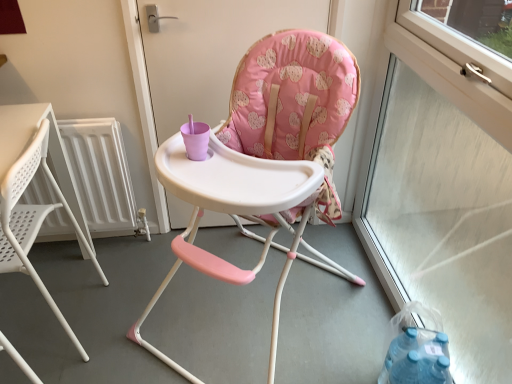
The height and width of the screenshot is (384, 512). Describe the element at coordinates (102, 175) in the screenshot. I see `white metallic radiator at left` at that location.

In order to click on matte plastic highchair at center, which is the 1th chair in right-to-left order in this screenshot , I will do `click(271, 154)`.

Considering the sizes of objects transparent glass window at right and matte plastic highchair at center, which is the 1th chair in right-to-left order, in the image provided, who is smaller, transparent glass window at right or matte plastic highchair at center, which is the 1th chair in right-to-left order,?

transparent glass window at right is smaller.

The image size is (512, 384). Identify the location of the 1st chair behind the transparent glass window at right. (271, 154).

Could you measure the distance between transparent glass window at right and matte plastic highchair at center, the 2th chair from the left?

transparent glass window at right and matte plastic highchair at center, the 2th chair from the left, are 20.85 inches apart.

Is matte plastic highchair at center, which is the 1th chair in right-to-left order, at the back of transparent glass window at right?

Yes, transparent glass window at right's orientation is away from matte plastic highchair at center, which is the 1th chair in right-to-left order.

What's the angular difference between pink fabric high chair at center and transparent glass window at right's facing directions?

89.4 degrees separate the facing orientations of pink fabric high chair at center and transparent glass window at right.

From a real-world perspective, is pink fabric high chair at center physically above transparent glass window at right?

No, from a real-world perspective, pink fabric high chair at center is not above transparent glass window at right.

Considering the relative positions of pink fabric high chair at center and transparent glass window at right in the image provided, is pink fabric high chair at center behind transparent glass window at right?

Yes, pink fabric high chair at center is further from the camera.

Considering the sizes of objects pink fabric high chair at center and transparent glass window at right in the image provided, who is wider, pink fabric high chair at center or transparent glass window at right?

With larger width is transparent glass window at right.

Considering the sizes of objects transparent glass window at right and white metallic radiator at left in the image provided, who is taller, transparent glass window at right or white metallic radiator at left?

Standing taller between the two is transparent glass window at right.

Considering the sizes of objects transparent glass window at right and white metallic radiator at left in the image provided, who is thinner, transparent glass window at right or white metallic radiator at left?

With smaller width is white metallic radiator at left.

Which object is more forward, transparent glass window at right or white metallic radiator at left?

transparent glass window at right.

Which object is positioned more to the left, transparent glass window at right or white metallic radiator at left?

white metallic radiator at left.

From a real-world perspective, is white metallic radiator at left on matte plastic highchair at center, the 2th chair from the left?

No.

Can you confirm if white metallic radiator at left is smaller than matte plastic highchair at center, the 2th chair from the left?

Indeed, white metallic radiator at left has a smaller size compared to matte plastic highchair at center, the 2th chair from the left.

Can you confirm if white metallic radiator at left is thinner than matte plastic highchair at center, which is the 1th chair in right-to-left order?

Correct, the width of white metallic radiator at left is less than that of matte plastic highchair at center, which is the 1th chair in right-to-left order.

How far apart are white metallic radiator at left and matte plastic highchair at center, the 2th chair from the left?

white metallic radiator at left and matte plastic highchair at center, the 2th chair from the left, are 26.57 inches apart from each other.

From a real-world perspective, which is physically above, white plastic chair at left, the first chair viewed from the left, or transparent glass window at right?

transparent glass window at right is physically above.

Measure the distance from white plastic chair at left, acting as the 2th chair starting from the right, to transparent glass window at right.

white plastic chair at left, acting as the 2th chair starting from the right, and transparent glass window at right are 4.72 feet apart from each other.

From their relative heights in the image, would you say white plastic chair at left, the first chair viewed from the left, is taller or shorter than transparent glass window at right?

Considering their sizes, white plastic chair at left, the first chair viewed from the left, has less height than transparent glass window at right.

Is white plastic chair at left, the first chair viewed from the left, inside or outside of transparent glass window at right?

white plastic chair at left, the first chair viewed from the left, is not enclosed by transparent glass window at right.

Who is smaller, white metallic radiator at left or pink fabric high chair at center?

white metallic radiator at left is smaller.

Between white metallic radiator at left and pink fabric high chair at center, which one has more height?

With more height is pink fabric high chair at center.

Which object is further away from the camera, white metallic radiator at left or pink fabric high chair at center?

Positioned behind is white metallic radiator at left.

From the image's perspective, would you say white plastic chair at left, the first chair viewed from the left, is shown under matte plastic highchair at center, the 2th chair from the left?

Indeed, from the image's perspective, white plastic chair at left, the first chair viewed from the left, is shown beneath matte plastic highchair at center, the 2th chair from the left.

Which is in front, white plastic chair at left, the first chair viewed from the left, or matte plastic highchair at center, which is the 1th chair in right-to-left order?

Positioned in front is matte plastic highchair at center, which is the 1th chair in right-to-left order.

Is point (80, 239) positioned in front of point (331, 66)?

That is False.

Does white plastic chair at left, acting as the 2th chair starting from the right, turn towards matte plastic highchair at center, the 2th chair from the left?

No, white plastic chair at left, acting as the 2th chair starting from the right, is not oriented towards matte plastic highchair at center, the 2th chair from the left.

I want to click on the 1st chair positioned below the transparent glass window at right (from a real-world perspective), so click(x=271, y=154).

This screenshot has width=512, height=384. What are the coordinates of `window screen below the pink fabric high chair at center (from the image's perspective)` in the screenshot? It's located at (447, 176).

Looking at the image, which one is located further to pink fabric high chair at center, transparent glass window at right or white plastic chair at left, acting as the 2th chair starting from the right?

transparent glass window at right lies further to pink fabric high chair at center than the other object.

From the image, which object appears to be nearer to matte plastic highchair at center, which is the 1th chair in right-to-left order, transparent glass window at right or pink fabric high chair at center?

pink fabric high chair at center lies closer to matte plastic highchair at center, which is the 1th chair in right-to-left order, than the other object.

Based on their spatial positions, is white metallic radiator at left or matte plastic highchair at center, the 2th chair from the left, further from transparent glass window at right?

The object further to transparent glass window at right is white metallic radiator at left.

Estimate the real-world distances between objects in this image. Which object is further from pink fabric high chair at center, matte plastic highchair at center, the 2th chair from the left, or transparent glass window at right?

transparent glass window at right.

Which object lies further to the anchor point white metallic radiator at left, white plastic chair at left, acting as the 2th chair starting from the right, or matte plastic highchair at center, which is the 1th chair in right-to-left order?

Among the two, matte plastic highchair at center, which is the 1th chair in right-to-left order, is located further to white metallic radiator at left.

Looking at the image, which one is located further to white metallic radiator at left, matte plastic highchair at center, which is the 1th chair in right-to-left order, or pink fabric high chair at center?

Among the two, matte plastic highchair at center, which is the 1th chair in right-to-left order, is located further to white metallic radiator at left.

Considering their positions, is matte plastic highchair at center, the 2th chair from the left, positioned closer to pink fabric high chair at center than white metallic radiator at left?

matte plastic highchair at center, the 2th chair from the left, lies closer to pink fabric high chair at center than the other object.

Considering their positions, is pink fabric high chair at center positioned closer to white plastic chair at left, the first chair viewed from the left, than transparent glass window at right?

pink fabric high chair at center is positioned closer to the anchor white plastic chair at left, the first chair viewed from the left.

Locate an element on the screen. This screenshot has width=512, height=384. radiator situated between white plastic chair at left, acting as the 2th chair starting from the right, and pink fabric high chair at center from left to right is located at coordinates (102, 175).

This screenshot has height=384, width=512. Identify the location of screen door positioned between matte plastic highchair at center, the 2th chair from the left, and white metallic radiator at left from near to far. (210, 51).

The image size is (512, 384). Find the location of `radiator between white plastic chair at left, acting as the 2th chair starting from the right, and matte plastic highchair at center, the 2th chair from the left`. radiator between white plastic chair at left, acting as the 2th chair starting from the right, and matte plastic highchair at center, the 2th chair from the left is located at coordinates (102, 175).

Locate an element on the screen. This screenshot has height=384, width=512. chair situated between white plastic chair at left, acting as the 2th chair starting from the right, and transparent glass window at right from left to right is located at coordinates (271, 154).